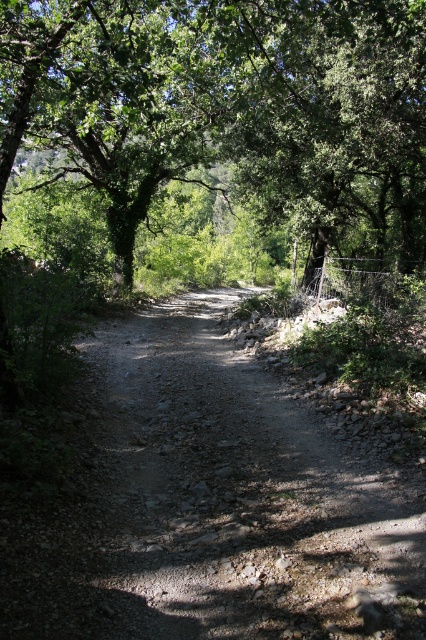
You are a hiker trying to decide whether to walk along the dusty gravel path at center or stay under the shade of the green leafy tree at center. Which option provides more space for you to move around comfortably?

The dusty gravel path at center has a smaller size compared to green leafy tree at center, so the green leafy tree at center offers more space to move around comfortably.

You are standing at the starting point of the dirt path in the forest. You notice two points marked on the path ahead of you. One is at coordinate point (213,504) and the other at point (190,161). Which of these points is closer to your current position?

Point (213,504) is closer to the camera than point (190,161), so the point at (213,504) is closer to your current position.

You are a hiker standing at the start of the dusty gravel path at center and looking towards the green leafy tree at center. Which object is closer to you?

The dusty gravel path at center is closer to you than the green leafy tree at center because it is shorter in height.